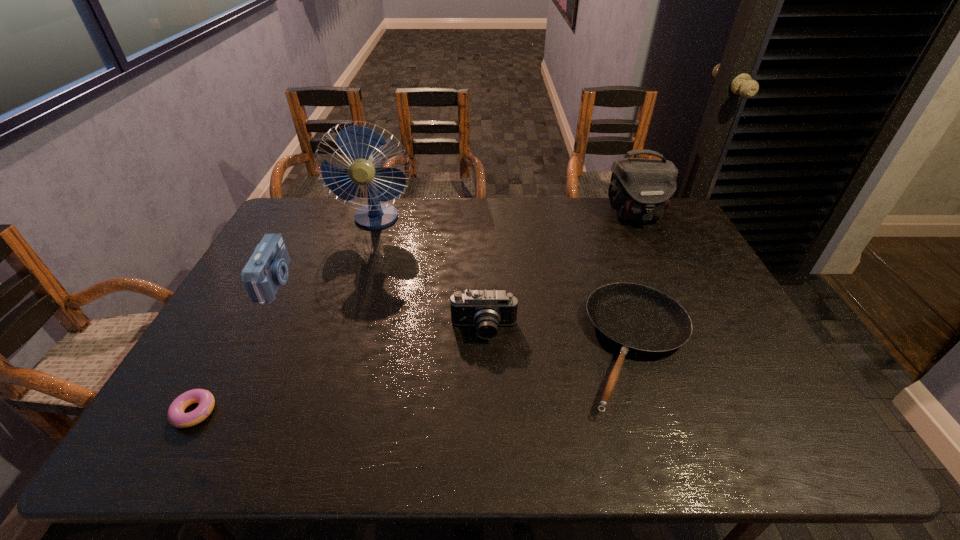
Find the location of a particular element. This screenshot has height=540, width=960. free region located on the lens of the farther camera is located at coordinates (401, 282).

You are a GUI agent. You are given a task and a screenshot of the screen. Output one action in this format:
    pyautogui.click(x=<x>, y=<y>)
    Task: Click on the vacant space located on the front-facing side of the nearer camera
    This screenshot has height=540, width=960.
    Given the screenshot: What is the action you would take?
    pyautogui.click(x=485, y=420)

You are a GUI agent. You are given a task and a screenshot of the screen. Output one action in this format:
    pyautogui.click(x=<x>, y=<y>)
    Task: Click on the free space located on the right of the frying pan
    
    Given the screenshot: What is the action you would take?
    click(x=730, y=348)

Where is `vacant space located on the right of the doughnut`? Image resolution: width=960 pixels, height=540 pixels. vacant space located on the right of the doughnut is located at coordinates (259, 412).

Find the location of `fan located in the far edge section of the desktop`. fan located in the far edge section of the desktop is located at coordinates (357, 142).

The image size is (960, 540). Find the location of `shoulder bag that is positioned at the far edge`. shoulder bag that is positioned at the far edge is located at coordinates (641, 189).

Image resolution: width=960 pixels, height=540 pixels. Identify the location of frying pan that is positioned at the near edge. (639, 319).

Locate an element on the screen. The height and width of the screenshot is (540, 960). doughnut located in the near edge section of the desktop is located at coordinates (175, 414).

Find the location of a particular element. The height and width of the screenshot is (540, 960). camera located in the left edge section of the desktop is located at coordinates (267, 269).

The width and height of the screenshot is (960, 540). I want to click on doughnut at the left edge, so click(175, 414).